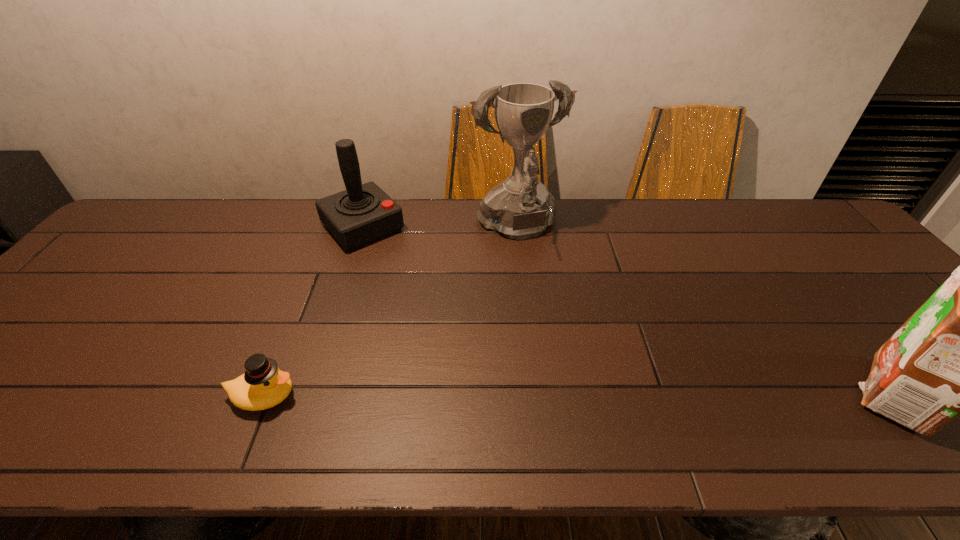
The width and height of the screenshot is (960, 540). Find the location of `free space that is in between the tallest object and the joystick`. free space that is in between the tallest object and the joystick is located at coordinates (440, 228).

Locate an element on the screen. The width and height of the screenshot is (960, 540). empty space that is in between the tallest object and the joystick is located at coordinates (440, 228).

Identify the location of free space that is in between the joystick and the shortest object. This screenshot has height=540, width=960. (313, 312).

Image resolution: width=960 pixels, height=540 pixels. I want to click on free spot between the third object from left to right and the shortest object, so click(391, 313).

The width and height of the screenshot is (960, 540). Find the location of `unoccupied position between the joystick and the duck`. unoccupied position between the joystick and the duck is located at coordinates (313, 312).

Locate an element on the screen. blank region between the award and the shortest object is located at coordinates (391, 313).

Point out which object is positioned as the third nearest to the joystick. Please provide its 2D coordinates. Your answer should be formatted as a tuple, i.e. [(x, y)], where the tuple contains the x and y coordinates of a point satisfying the conditions above.

[(959, 354)]

You are a GUI agent. You are given a task and a screenshot of the screen. Output one action in this format:
    pyautogui.click(x=<x>, y=<y>)
    Task: Click on the closest object to the second object from right to left
    This screenshot has height=540, width=960.
    Given the screenshot: What is the action you would take?
    pyautogui.click(x=363, y=213)

Locate an element on the screen. The height and width of the screenshot is (540, 960). free space that satisfies the following two spatial constraints: 1. on the front side of the tallest object; 2. on the left side of the joystick is located at coordinates (362, 229).